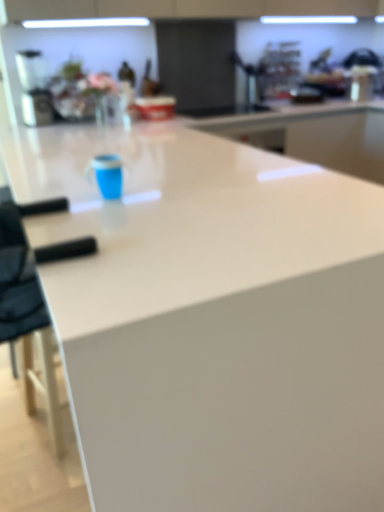
The width and height of the screenshot is (384, 512). What do you see at coordinates (34, 88) in the screenshot? I see `metallic silver coffee machine at upper left` at bounding box center [34, 88].

What is the approximate height of metallic silver coffee machine at upper left?

metallic silver coffee machine at upper left is 15.92 inches tall.

Locate an element on the screen. metallic silver coffee machine at upper left is located at coordinates (34, 88).

This screenshot has width=384, height=512. In order to click on metallic silver coffee machine at upper left in this screenshot , I will do `click(34, 88)`.